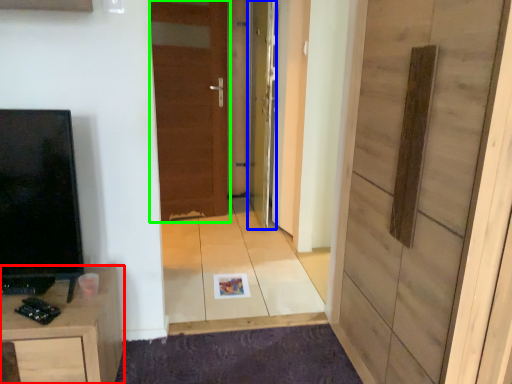
Question: Estimate the real-world distances between objects in this image. Which object is closer to cabinetry (highlighted by a red box), door (highlighted by a blue box) or door (highlighted by a green box)?

Choices:
 (A) door
 (B) door

Answer: (A)